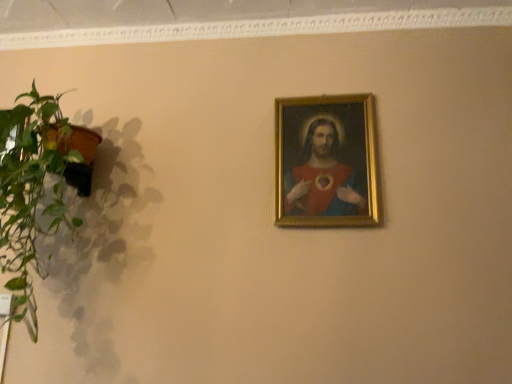
Question: Considering the relative positions of matte gold frame at upper center and green leafy plant at left in the image provided, is matte gold frame at upper center to the left or to the right of green leafy plant at left?

Choices:
 (A) right
 (B) left

Answer: (A)

Question: From a real-world perspective, is matte gold frame at upper center positioned above or below green leafy plant at left?

Choices:
 (A) below
 (B) above

Answer: (B)

Question: Which is correct: matte gold frame at upper center is inside green leafy plant at left, or outside of it?

Choices:
 (A) inside
 (B) outside

Answer: (B)

Question: In the image, is green leafy plant at left on the left side or the right side of matte gold frame at upper center?

Choices:
 (A) left
 (B) right

Answer: (A)

Question: Is green leafy plant at left wider or thinner than matte gold frame at upper center?

Choices:
 (A) thin
 (B) wide

Answer: (B)

Question: Considering the positions of point (10, 216) and point (315, 153), is point (10, 216) closer or farther from the camera than point (315, 153)?

Choices:
 (A) closer
 (B) farther

Answer: (A)

Question: In terms of size, does green leafy plant at left appear bigger or smaller than matte gold frame at upper center?

Choices:
 (A) small
 (B) big

Answer: (B)